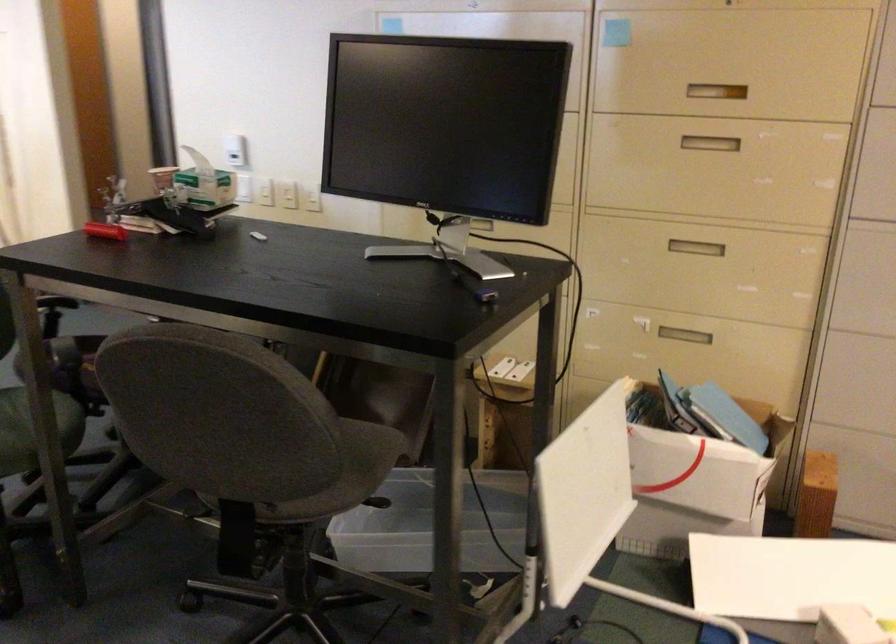
Identify the location of green tissue box. The width and height of the screenshot is (896, 644). (694, 484).